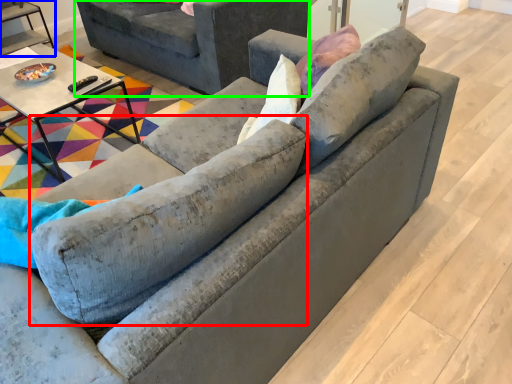
Question: Which object is positioned farthest from swivel chair (highlighted by a red box)? Select from table (highlighted by a blue box) and studio couch (highlighted by a green box).

Choices:
 (A) table
 (B) studio couch

Answer: (A)